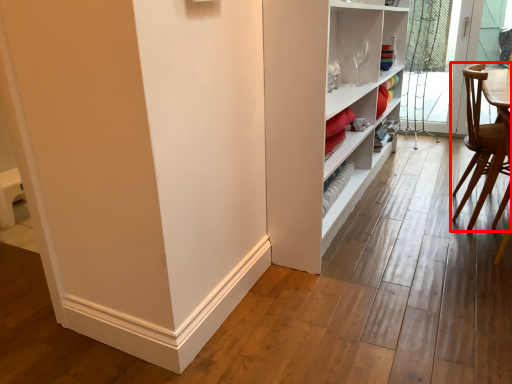
Question: From the image's perspective, considering the relative positions of chair (annotated by the red box) and screen door in the image provided, where is chair (annotated by the red box) located with respect to the staircase?

Choices:
 (A) above
 (B) below

Answer: (B)